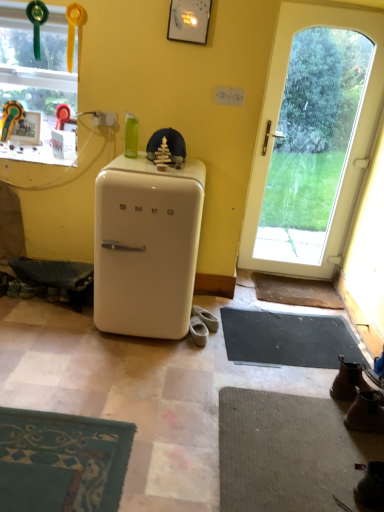
Where is `free spot above black rubber yoga mat at lower right (from a real-world perspective)`? Image resolution: width=384 pixels, height=512 pixels. free spot above black rubber yoga mat at lower right (from a real-world perspective) is located at coordinates tap(296, 338).